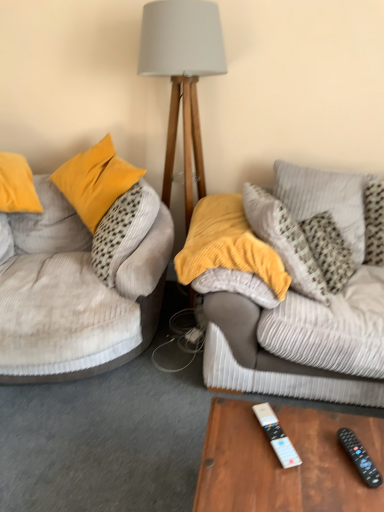
I want to click on unoccupied area behind black plastic remote control at lower right, positioned as the 2th remote control in left-to-right order, so click(336, 426).